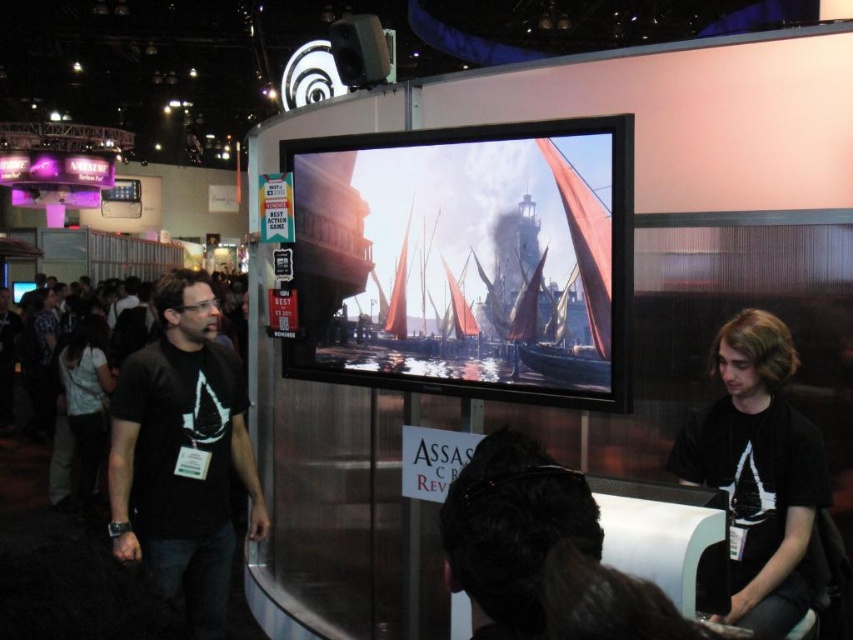
Between point (144, 385) and point (821, 492), which one is positioned behind?

Point (144, 385)

Between black matte t-shirt at left and black matte hair at lower right, which one appears on the left side from the viewer's perspective?

Positioned to the left is black matte t-shirt at left.

You are a GUI agent. You are given a task and a screenshot of the screen. Output one action in this format:
    pyautogui.click(x=<x>, y=<y>)
    Task: Click on the black matte t-shirt at left
    The width and height of the screenshot is (853, 640).
    Given the screenshot: What is the action you would take?
    pyautogui.click(x=183, y=454)

Is matte black screen at center in front of white matte shirt at lower left?

Yes, it is.

Between point (500, 317) and point (84, 406), which one is positioned in front?

Positioned in front is point (500, 317).

Where is `matte black screen at center`? matte black screen at center is located at coordinates (466, 260).

Which of these two, matte black screen at center or black matte t-shirt at left, stands taller?

black matte t-shirt at left

Is point (375, 168) more distant than point (213, 406)?

No, it is not.

Describe the element at coordinates (466, 260) in the screenshot. The image size is (853, 640). I see `matte black screen at center` at that location.

The height and width of the screenshot is (640, 853). What are the coordinates of `matte black screen at center` in the screenshot? It's located at [x=466, y=260].